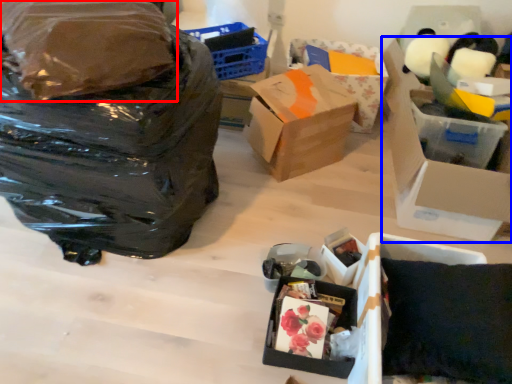
Question: Among these objects, which one is nearest to the camera, plastic bag (highlighted by a red box) or box (highlighted by a blue box)?

Choices:
 (A) plastic bag
 (B) box

Answer: (A)